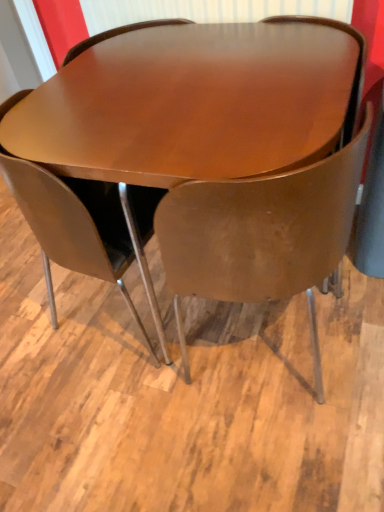
You are a GUI agent. You are given a task and a screenshot of the screen. Output one action in this format:
    pyautogui.click(x=<x>, y=<y>)
    Task: Click on the vacant area that lies in front of matte brown chair at center, the first chair in the right-to-left sequence
    
    Given the screenshot: What is the action you would take?
    284,445